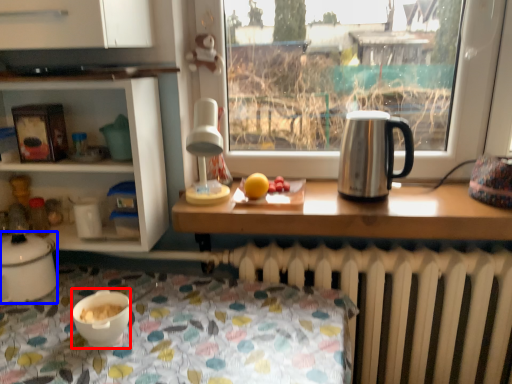
Question: Which object appears closest to the camera in this image, coffee cup (highlighted by a red box) or kitchen appliance (highlighted by a blue box)?

Choices:
 (A) coffee cup
 (B) kitchen appliance

Answer: (A)